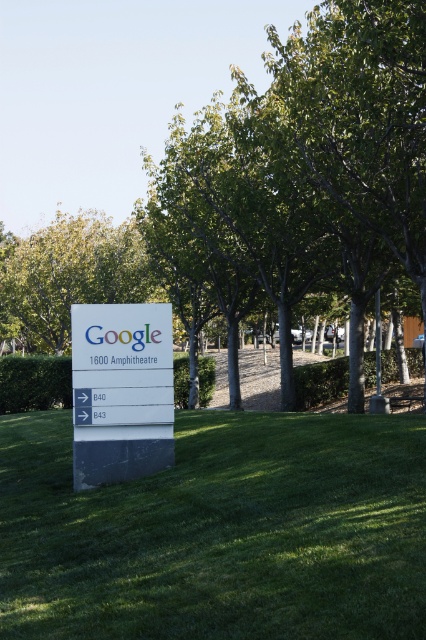
You are standing at the entrance of the Google facility and see the signboard with the Google logo. There is a point marked at coordinates (322, 145) on the image. What object is located at this point?

The point at coordinates (322, 145) indicates a green leafy tree at center.